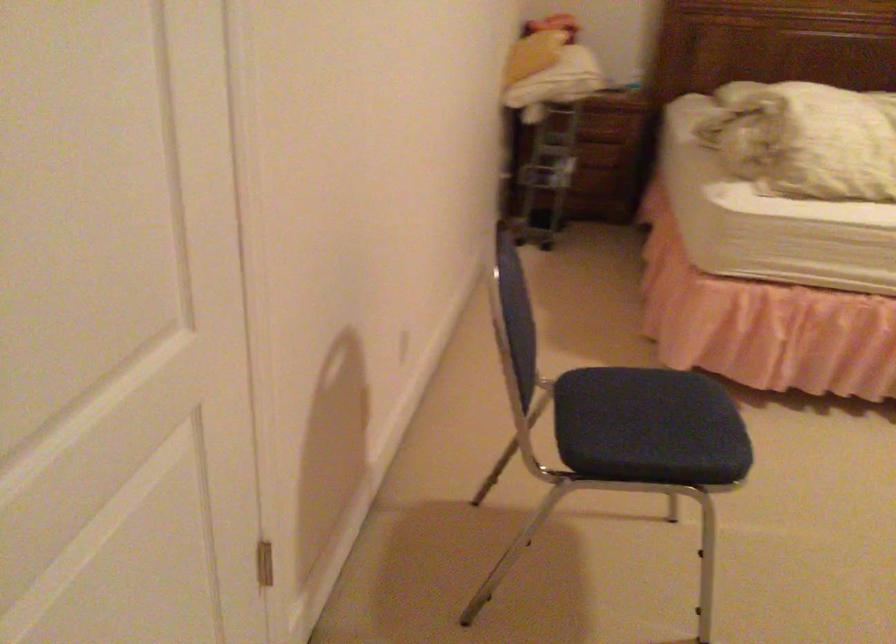
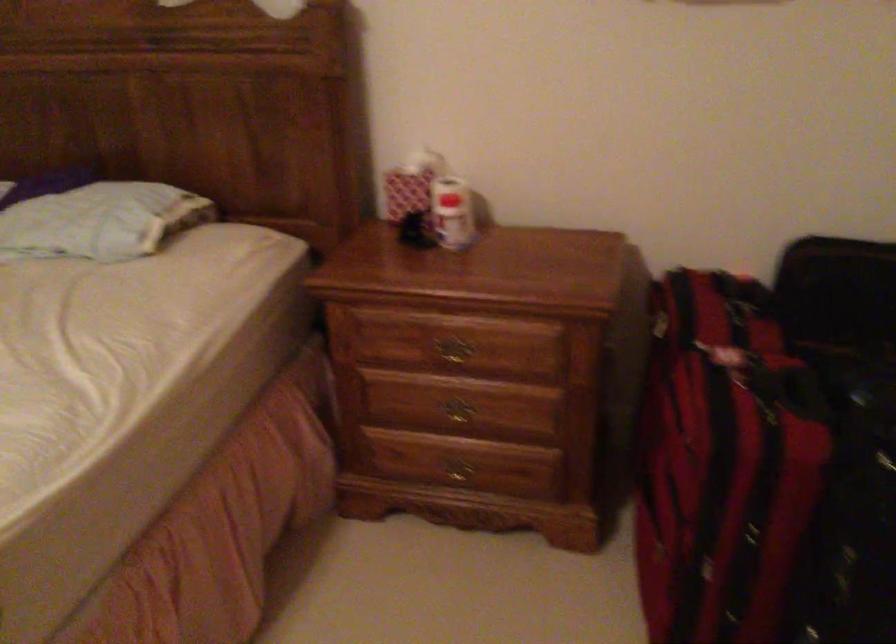
What movement of the cameraman would produce the second image?

The cameraman moved toward right, forward.